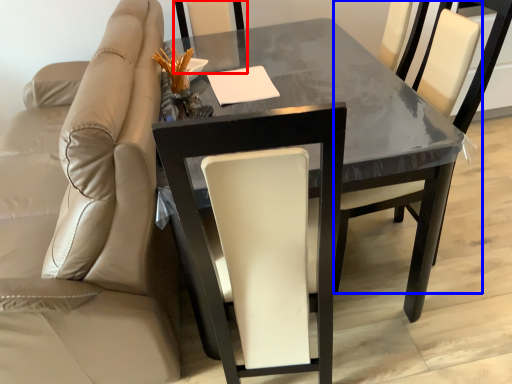
Question: Which object is further to the camera taking this photo, chair (highlighted by a red box) or chair (highlighted by a blue box)?

Choices:
 (A) chair
 (B) chair

Answer: (A)